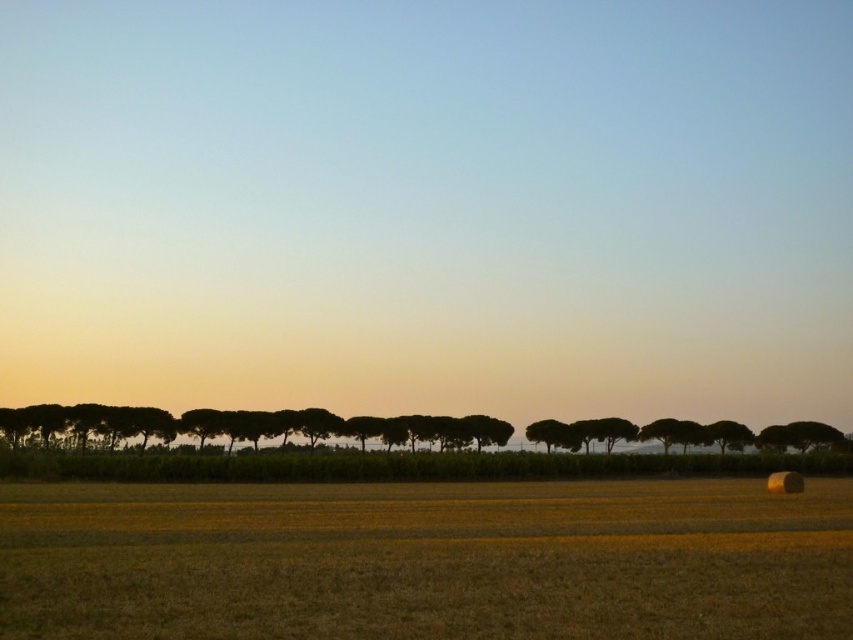
Is yellow grass at lower center above silhouette/leafy trees at center?

Yes, yellow grass at lower center is above silhouette/leafy trees at center.

Can you confirm if yellow grass at lower center is wider than silhouette/leafy trees at center?

Result: In fact, yellow grass at lower center might be narrower than silhouette/leafy trees at center.

Describe the element at coordinates (426, 561) in the screenshot. I see `yellow grass at lower center` at that location.

You are a GUI agent. You are given a task and a screenshot of the screen. Output one action in this format:
    pyautogui.click(x=<x>, y=<y>)
    Task: Click on the yellow grass at lower center
    The height and width of the screenshot is (640, 853).
    Given the screenshot: What is the action you would take?
    pyautogui.click(x=426, y=561)

Between point (314, 502) and point (569, 438), which one is positioned in front?

Point (314, 502) is in front.

Which is more to the left, yellow grass at lower center or silhouette/transparent tree at center?

Positioned to the left is yellow grass at lower center.

Who is more forward, (225, 588) or (543, 433)?

Point (225, 588) is more forward.

You are a GUI agent. You are given a task and a screenshot of the screen. Output one action in this format:
    pyautogui.click(x=<x>, y=<y>)
    Task: Click on the yellow grass at lower center
    The image size is (853, 640).
    Given the screenshot: What is the action you would take?
    pyautogui.click(x=426, y=561)

In the scene shown: Is the position of silhouette/leafy trees at center less distant than that of silhouette/transparent tree at center?

Yes.

Does silhouette/leafy trees at center lie behind silhouette/transparent tree at center?

No.

Is point (639, 433) positioned before point (531, 435)?

No, it is behind (531, 435).

Identify the location of silhouette/leafy trees at center. This screenshot has width=853, height=640. (239, 426).